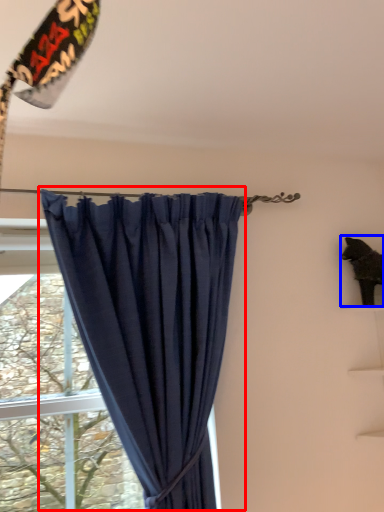
Question: Among these objects, which one is nearest to the camera, curtain (highlighted by a red box) or animal (highlighted by a blue box)?

Choices:
 (A) curtain
 (B) animal

Answer: (A)